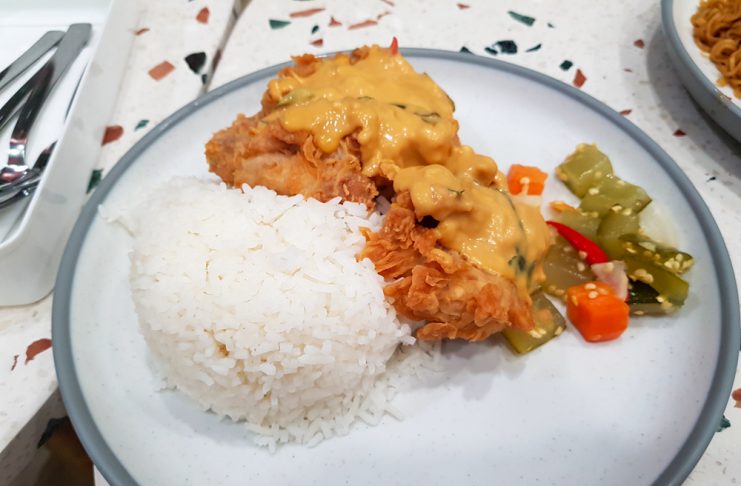
Where is `white plate`? This screenshot has width=741, height=486. white plate is located at coordinates (485, 124), (684, 14).